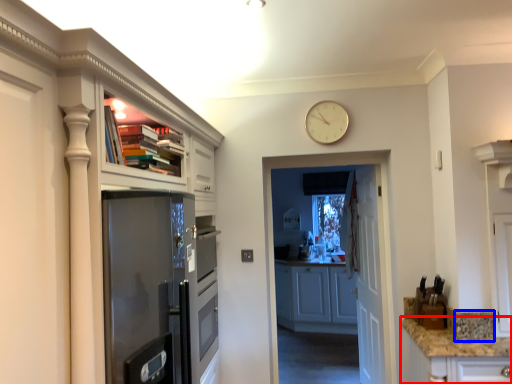
Question: Which of the following is the closest to the observer, counter top (highlighted by a red box) or gray (highlighted by a blue box)?

Choices:
 (A) counter top
 (B) gray

Answer: (A)